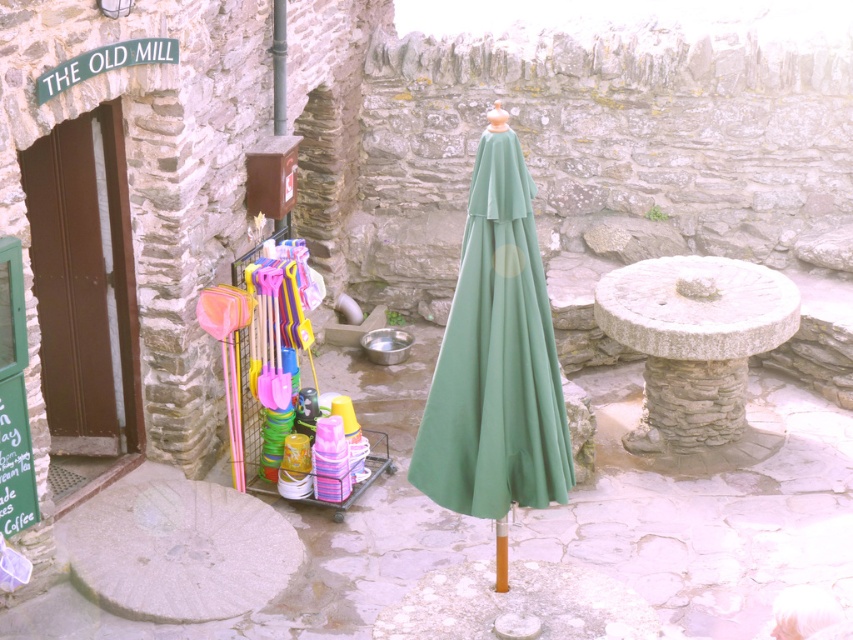
Question: Which object appears closest to the camera in this image?

Choices:
 (A) stone millstone at center
 (B) green fabric umbrella at center

Answer: (B)

Question: Does multicolored plastic utensils at center lie in front of metallic pole at center?

Choices:
 (A) no
 (B) yes

Answer: (B)

Question: Can you confirm if metallic pole at center is smaller than orange matte pole at center?

Choices:
 (A) no
 (B) yes

Answer: (A)

Question: Which point is farther to the camera?

Choices:
 (A) (500, 589)
 (B) (288, 280)
 (C) (469, 364)
 (D) (279, 28)

Answer: (D)

Question: Estimate the real-world distances between objects in this image. Which object is closer to the stone millstone at center?

Choices:
 (A) green fabric umbrella at center
 (B) multicolored plastic utensils at center
 (C) orange matte pole at center
 (D) metallic pole at center

Answer: (A)

Question: Can you confirm if multicolored plastic utensils at center is positioned to the right of orange matte pole at center?

Choices:
 (A) yes
 (B) no

Answer: (B)